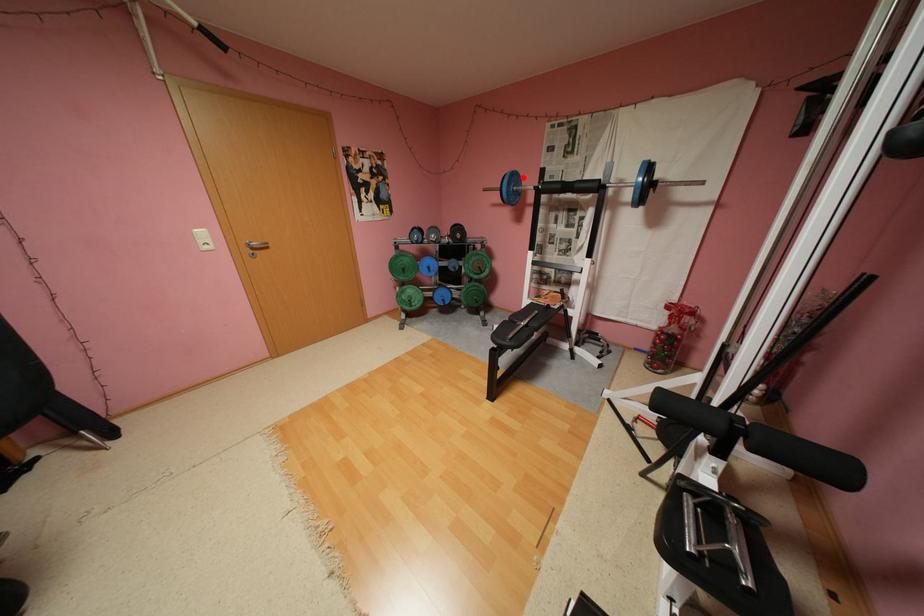
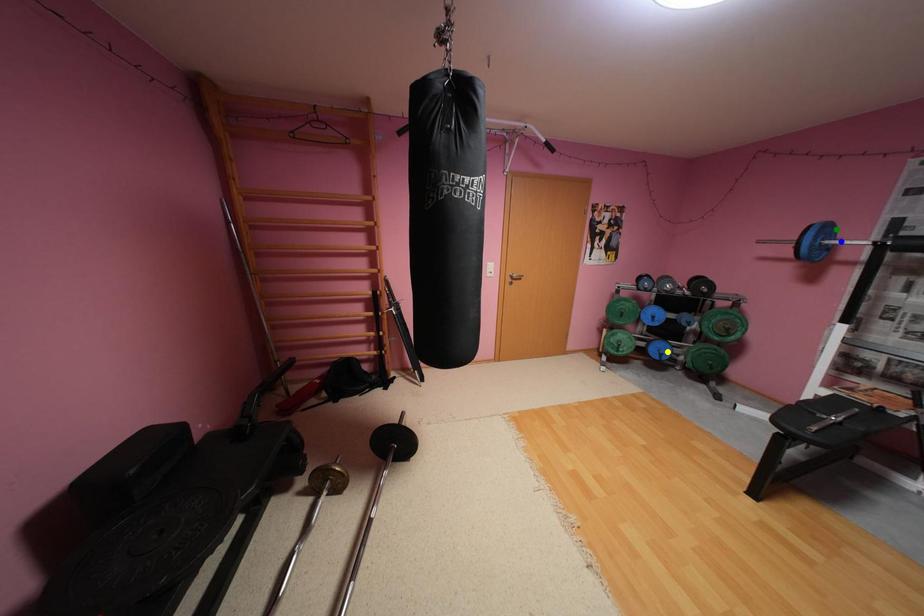
Question: I am providing you with two images of the same scene from different viewpoints. A red point is marked on the first image. You are given multiple points on the second image. Which point in image 2 is actually the same real-world point as the red point in image 1?

Choices:
 (A) green point
 (B) yellow point
 (C) blue point

Answer: (A)